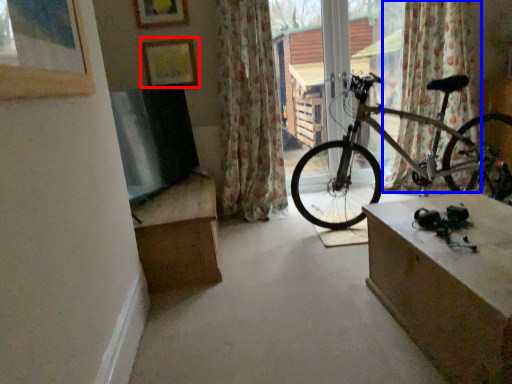
Question: Which object is closer to the camera taking this photo, picture frame (highlighted by a red box) or curtain (highlighted by a blue box)?

Choices:
 (A) picture frame
 (B) curtain

Answer: (B)